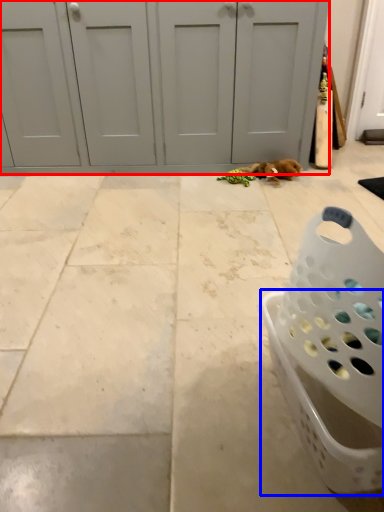
Question: Which of the following is the farthest to the observer, door (highlighted by a red box) or basket (highlighted by a blue box)?

Choices:
 (A) door
 (B) basket

Answer: (A)